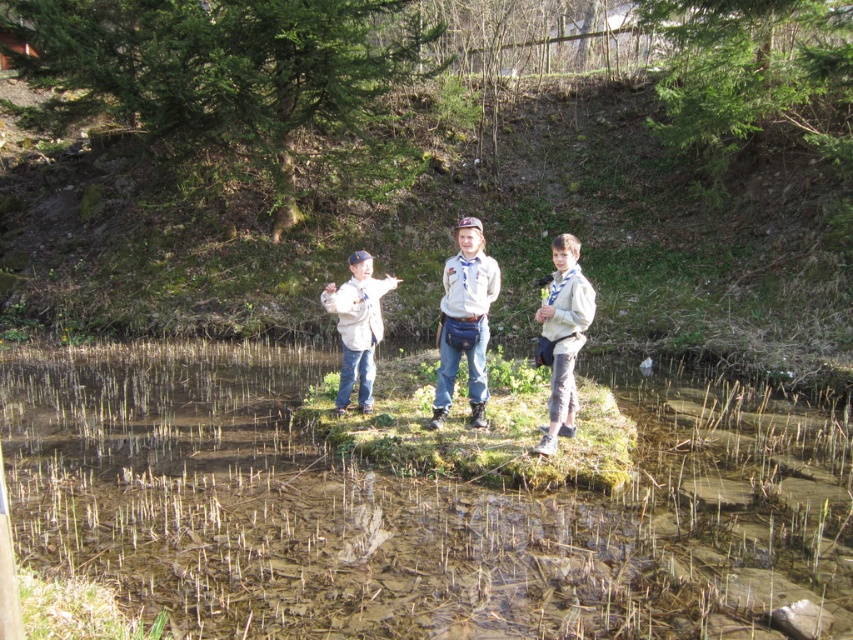
Consider the image. You are a hiker trying to cross the area shown in the image. You need to step from the gray cotton shirt at center to the clear water at center. Based on their widths, can you safely make this move without slipping?

The clear water at center is wider than the gray cotton shirt at center, so stepping from the gray cotton shirt at center to the clear water at center may be risky due to the water being wider and potentially less stable underfoot.

You are part of a hiking group and need to cross the area shown in the image. The clear water at center and the gray cotton shirt at center are in your path. Which object should you avoid stepping on to stay dry?

You should avoid stepping on the clear water at center because it is located to the left of the gray cotton shirt at center, and stepping into the water would make you wet.

You are a hiker trying to cross the area shown in the image. You see the clear water at center and the light brown uniform at center. Which object is located to the left of the other?

The clear water at center is positioned on the left side of light brown uniform at center.